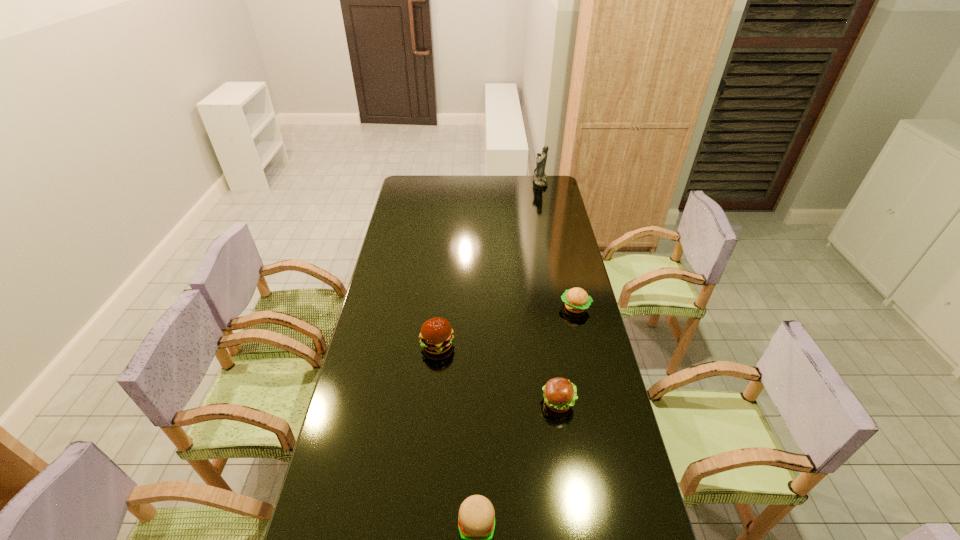
You are a GUI agent. You are given a task and a screenshot of the screen. Output one action in this format:
    pyautogui.click(x=<x>, y=<y>)
    Task: Click on the blank space located on the front-facing side of the figurine
    The width and height of the screenshot is (960, 540).
    Given the screenshot: What is the action you would take?
    pyautogui.click(x=510, y=181)

At what (x,y) coordinates should I click in order to perform the action: click on free space located 0.150m on the left of the third nearest hamburger. Please return your answer as a coordinate pair (x, y). Looking at the image, I should click on (x=378, y=345).

Find the location of a particular element. The height and width of the screenshot is (540, 960). free region located 0.230m on the front of the second hamburger from right to left is located at coordinates (572, 493).

Where is `vacant space positioned 0.310m on the left of the rightmost hamburger`? The height and width of the screenshot is (540, 960). vacant space positioned 0.310m on the left of the rightmost hamburger is located at coordinates (481, 307).

Find the location of a particular element. object that is at the far edge is located at coordinates (540, 178).

Locate an element on the screen. The image size is (960, 540). figurine situated at the right edge is located at coordinates (540, 178).

Find the location of a particular element. The image size is (960, 540). object positioned at the far right corner is located at coordinates (540, 178).

Identify the location of vacant point at the far edge. (525, 178).

You are a GUI agent. You are given a task and a screenshot of the screen. Output one action in this format:
    pyautogui.click(x=<x>, y=<y>)
    Task: Click on the vacant space at the left edge of the desktop
    
    Given the screenshot: What is the action you would take?
    pyautogui.click(x=403, y=267)

This screenshot has height=540, width=960. What are the coordinates of `free space at the right edge` in the screenshot? It's located at pos(550,235).